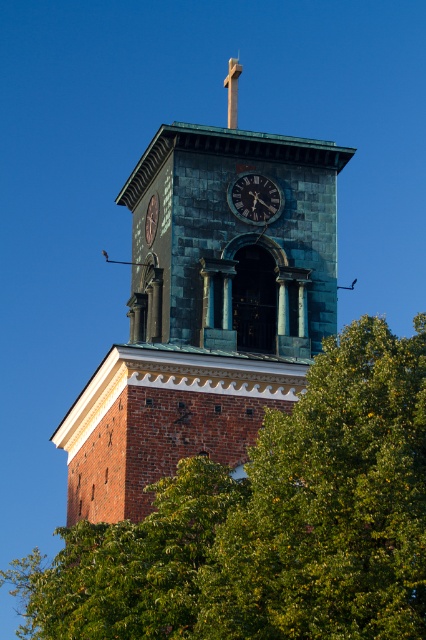
You are an architect analyzing the clock tower. Which object, the dark blue metallic clock at center or the smooth gold cross at upper center, is larger in size?

The smooth gold cross at upper center is larger than the dark blue metallic clock at center.